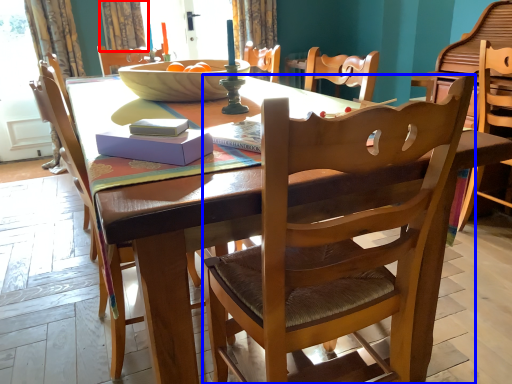
Question: Which object is closer to the camera taking this photo, curtain (highlighted by a red box) or chair (highlighted by a blue box)?

Choices:
 (A) curtain
 (B) chair

Answer: (B)